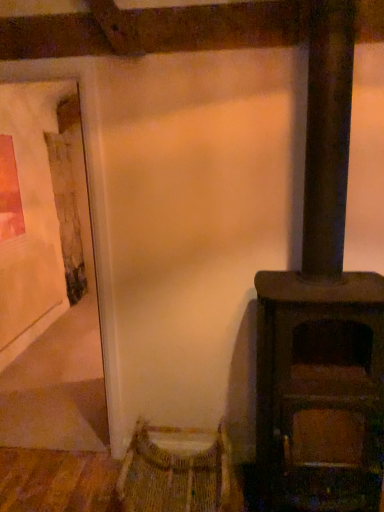
The image size is (384, 512). I want to click on woven wood stool at lower left, so click(178, 472).

Describe the element at coordinates (178, 472) in the screenshot. The height and width of the screenshot is (512, 384). I see `woven wood stool at lower left` at that location.

Locate an element on the screen. woven wood stool at lower left is located at coordinates (178, 472).